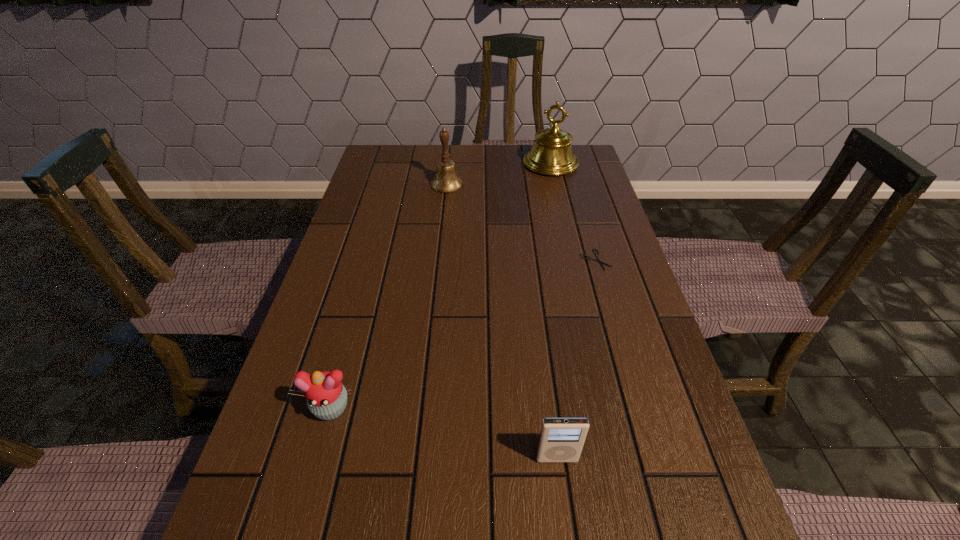
I want to click on vacant point located between the leftmost object and the right bell, so click(441, 286).

At what (x,y) coordinates should I click in order to perform the action: click on blank region between the left bell and the cupcake. Please return your answer as a coordinate pair (x, y). The width and height of the screenshot is (960, 540). Looking at the image, I should click on (389, 296).

At what (x,y) coordinates should I click in order to perform the action: click on vacant space that's between the nearest object and the shortest object. Please return your answer as a coordinate pair (x, y). The image size is (960, 540). Looking at the image, I should click on (576, 359).

Locate an element on the screen. The height and width of the screenshot is (540, 960). vacant space in between the iPod and the shears is located at coordinates (576, 359).

The height and width of the screenshot is (540, 960). I want to click on free space between the shortest object and the fourth farthest object, so click(463, 334).

Identify the location of free spot between the fourth object from right to left and the iPod. The height and width of the screenshot is (540, 960). (502, 321).

Locate an element on the screen. This screenshot has height=540, width=960. vacant region between the iPod and the shears is located at coordinates (576, 359).

The image size is (960, 540). In order to click on free point between the fourth object from right to left and the third nearest object in this screenshot , I will do `click(521, 222)`.

Identify the location of free point between the nearest object and the left bell. (502, 321).

Where is `vacant point located between the shortest object and the second object from left to right`? vacant point located between the shortest object and the second object from left to right is located at coordinates (521, 222).